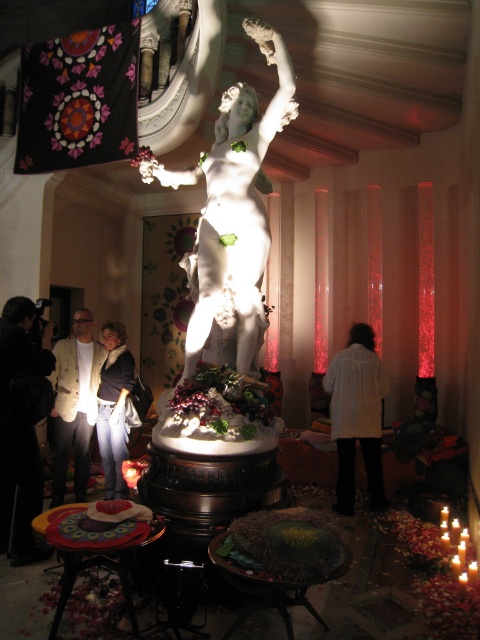
You are an interior designer planning to place a new sofa in this gallery. The sofa is 1.8 meters tall. Considering the white marble statue at center and the jeans at lower left, which object will the sofa be taller than?

The sofa will be taller than both the white marble statue at center and the jeans at lower left since it is 1.8 meters tall, which is taller than both objects.

You are an interior designer assessing the space. You have a new decorative item that is 10 cm thick. You need to decide whether to place it on the black fabric at left or the white textured jacket at center. Which location would allow the item to fit better based on thickness?

The black fabric at left is thinner than the white textured jacket at center, so placing the 10 cm thick decorative item on the white textured jacket at center would provide better support and stability due to its thicker base.